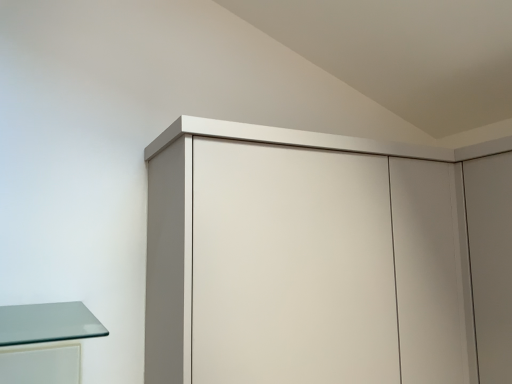
What do you see at coordinates (191, 222) in the screenshot?
I see `matte white cupboard at center` at bounding box center [191, 222].

At what (x,y) coordinates should I click in order to perform the action: click on matte white cupboard at center. Please return your answer as a coordinate pair (x, y). Looking at the image, I should click on (191, 222).

You are a GUI agent. You are given a task and a screenshot of the screen. Output one action in this format:
    pyautogui.click(x=<x>, y=<y>)
    Task: Click on the matte white cupboard at center
    The width and height of the screenshot is (512, 384).
    Given the screenshot: What is the action you would take?
    point(191,222)